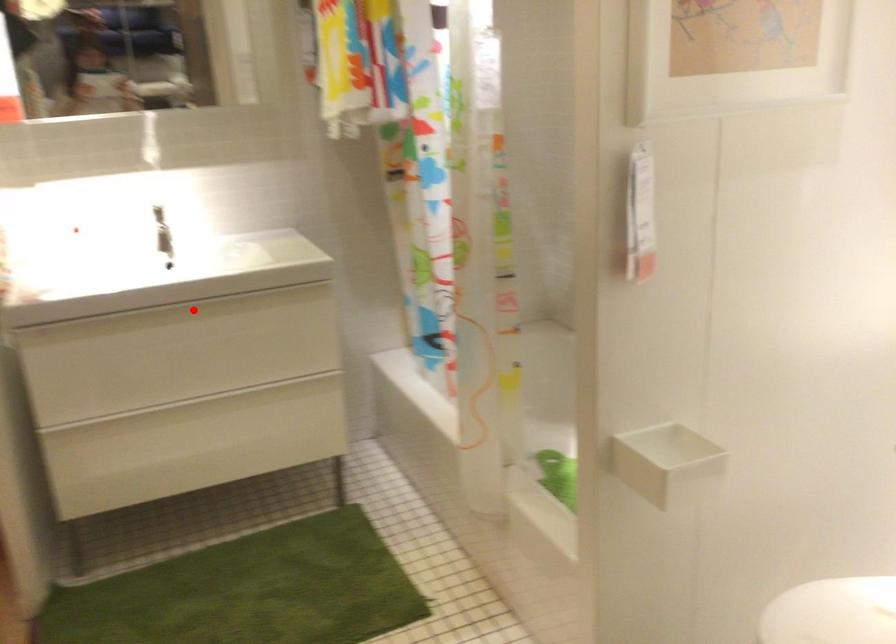
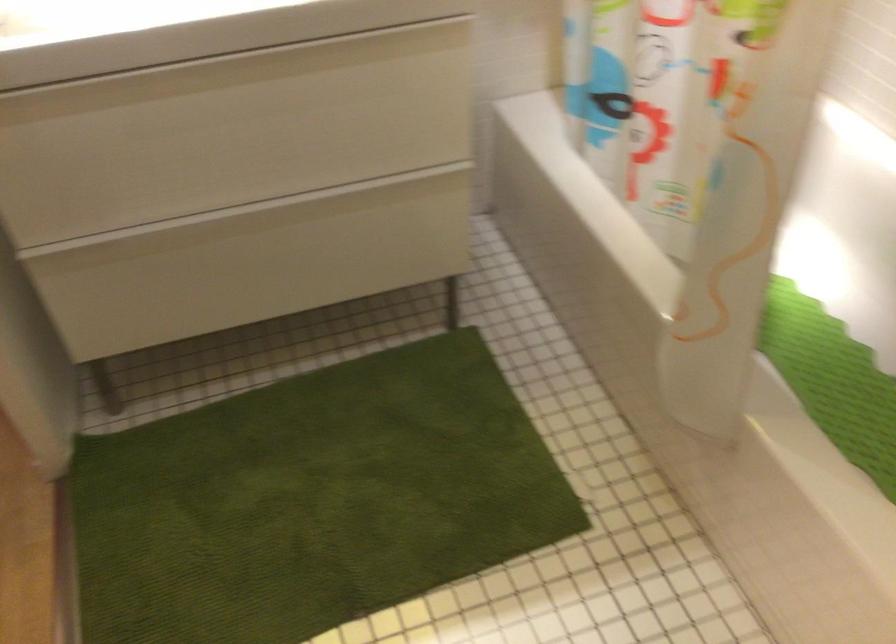
Question: A red point is marked in image1. In image2, is the corresponding 3D point closer to the camera or farther? Reply with the corresponding letter.

Choices:
 (A) The corresponding 3D point is closer.
 (B) The corresponding 3D point is farther.

Answer: (A)